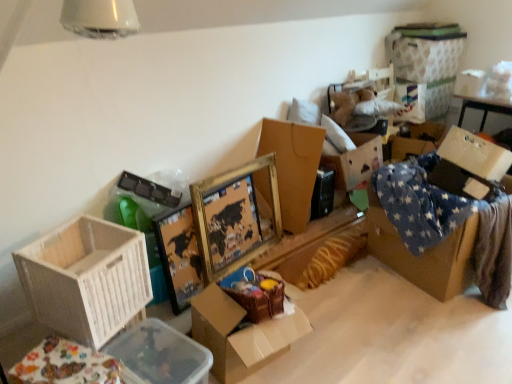
Locate an element on the screen. This screenshot has width=512, height=384. vacant area that is situated to the right of cardboard box at center, acting as the 2th box starting from the back is located at coordinates (352, 334).